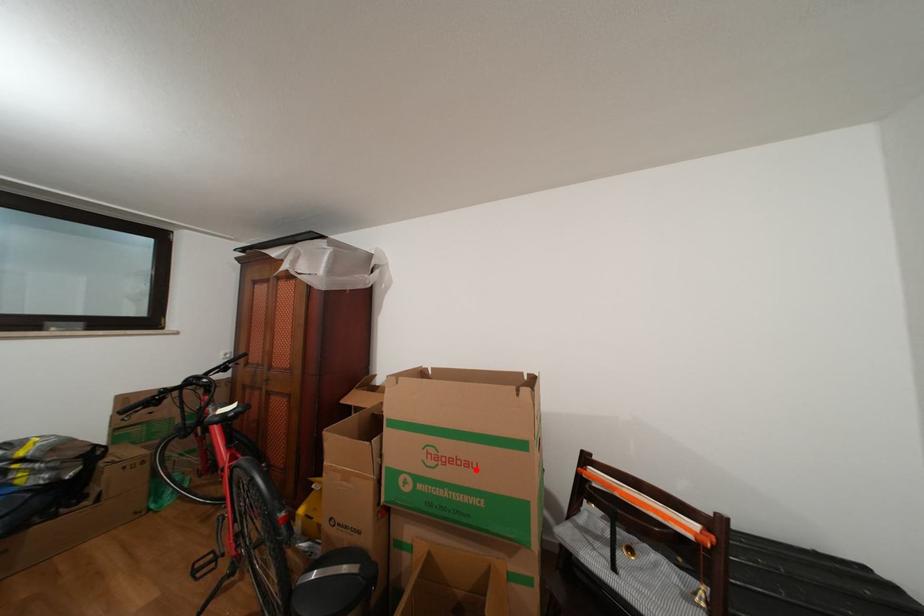
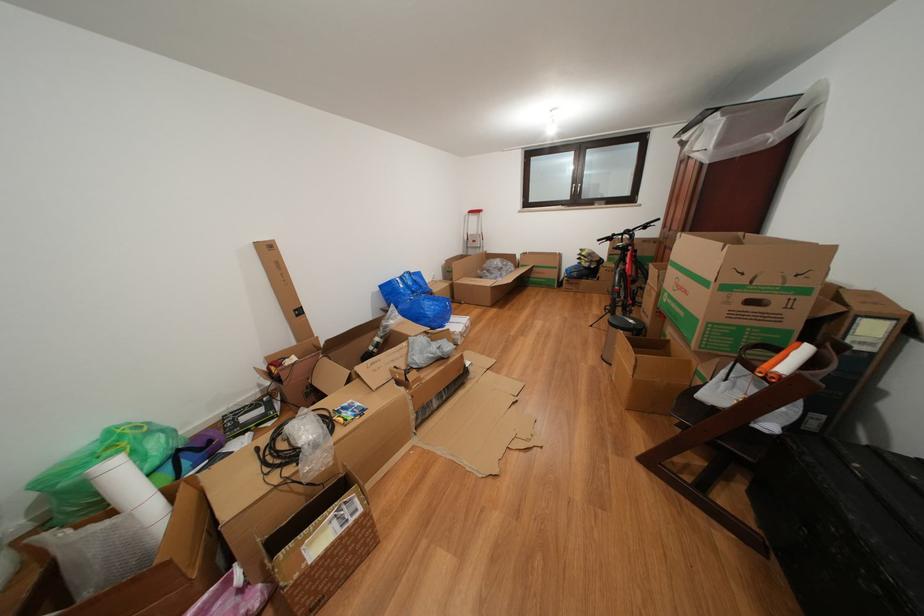
Question: I am providing you with two images of the same scene from different viewpoints. In image1, a red point is highlighted. Considering the same 3D point in image2, which of the following is correct?

Choices:
 (A) It is closer
 (B) It is farther

Answer: (A)